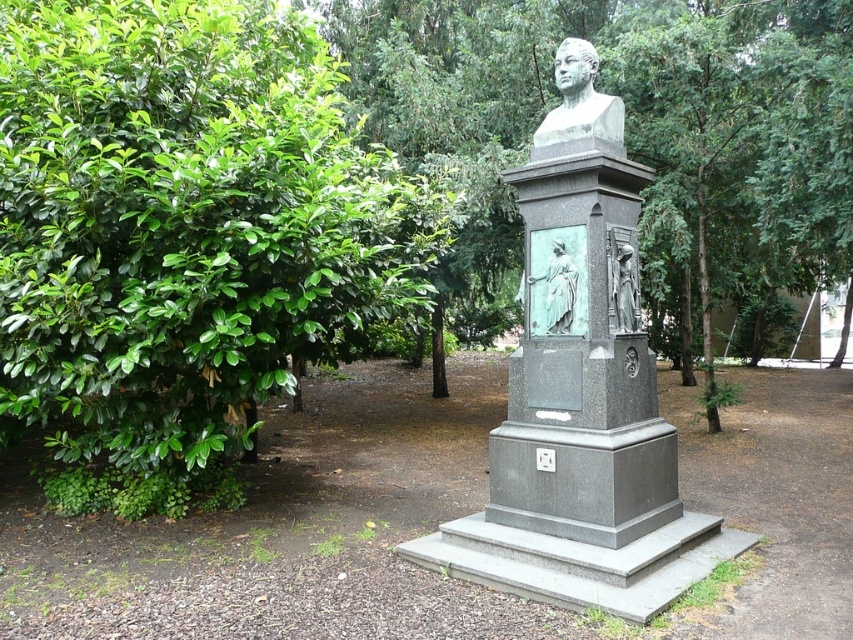
Question: Does green leafy bush at left come in front of green patina stone bust at center?

Choices:
 (A) no
 (B) yes

Answer: (B)

Question: Which point is farther to the camera?

Choices:
 (A) bronze bust at center
 (B) green patina stone bust at center

Answer: (A)

Question: Considering the relative positions of green patina stone bust at center and green patina statue at center in the image provided, where is green patina stone bust at center located with respect to green patina statue at center?

Choices:
 (A) right
 (B) left

Answer: (A)

Question: Estimate the real-world distances between objects in this image. Which object is farther from the green leafy bush at left?

Choices:
 (A) bronze relief figure at center
 (B) bronze bust at center
 (C) green patina statue at center
 (D) green patina stone bust at center

Answer: (A)

Question: Is green patina stone bust at center below bronze relief figure at center?

Choices:
 (A) yes
 (B) no

Answer: (A)

Question: Which object is the closest to the green patina stone bust at center?

Choices:
 (A) bronze relief figure at center
 (B) green leafy bush at left
 (C) bronze bust at center
 (D) green patina statue at center

Answer: (D)